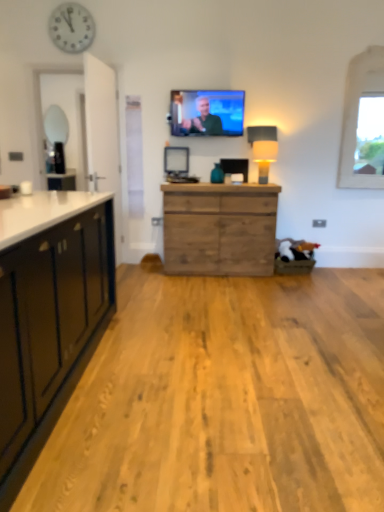
Question: Does white fabric lampshade at right have a lesser height compared to white stone window at upper right?

Choices:
 (A) no
 (B) yes

Answer: (B)

Question: Is white fabric lampshade at right to the left of white stone window at upper right from the viewer's perspective?

Choices:
 (A) no
 (B) yes

Answer: (B)

Question: From the image's perspective, is white fabric lampshade at right on white stone window at upper right?

Choices:
 (A) yes
 (B) no

Answer: (B)

Question: Is white fabric lampshade at right behind white stone window at upper right?

Choices:
 (A) yes
 (B) no

Answer: (B)

Question: Would you consider white fabric lampshade at right to be distant from white stone window at upper right?

Choices:
 (A) no
 (B) yes

Answer: (A)

Question: Considering their positions, is white fabric lampshade at right located in front of or behind matte black television at upper center?

Choices:
 (A) behind
 (B) front

Answer: (B)

Question: Is white fabric lampshade at right bigger or smaller than matte black television at upper center?

Choices:
 (A) big
 (B) small

Answer: (B)

Question: Would you say white fabric lampshade at right is inside or outside matte black television at upper center?

Choices:
 (A) inside
 (B) outside

Answer: (B)

Question: Is white fabric lampshade at right taller or shorter than matte black television at upper center?

Choices:
 (A) short
 (B) tall

Answer: (A)

Question: From a real-world perspective, is wooden chest of drawers at center above or below matte black television at upper center?

Choices:
 (A) above
 (B) below

Answer: (B)

Question: Is wooden chest of drawers at center bigger or smaller than matte black television at upper center?

Choices:
 (A) big
 (B) small

Answer: (A)

Question: From the image's perspective, is wooden chest of drawers at center above or below matte black television at upper center?

Choices:
 (A) above
 (B) below

Answer: (B)

Question: Based on their positions, is wooden chest of drawers at center located to the left or right of matte black television at upper center?

Choices:
 (A) left
 (B) right

Answer: (B)

Question: Would you say matte black television at upper center is to the left or to the right of white plastic clock at upper left in the picture?

Choices:
 (A) right
 (B) left

Answer: (A)

Question: Based on their sizes in the image, would you say matte black television at upper center is bigger or smaller than white plastic clock at upper left?

Choices:
 (A) small
 (B) big

Answer: (B)